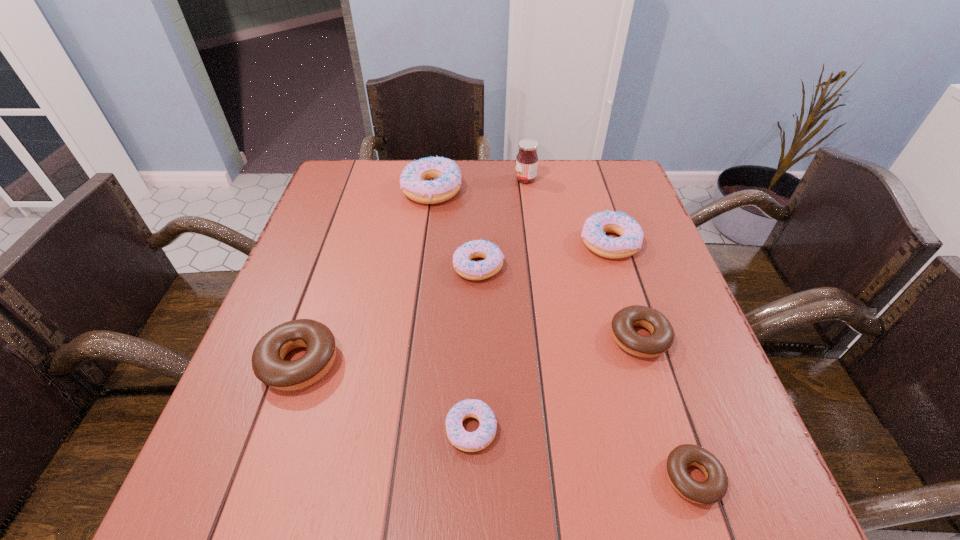
In the image, there is a desktop. Where is `free space at the far left corner`? free space at the far left corner is located at coordinates 348,184.

Identify the location of vacant region at the near left corner of the desktop. (248, 496).

Image resolution: width=960 pixels, height=540 pixels. In order to click on free spot at the far right corner of the desktop in this screenshot , I will do `click(612, 167)`.

Where is `vacant region at the near right corner of the desktop`? vacant region at the near right corner of the desktop is located at coordinates (776, 521).

You are a GUI agent. You are given a task and a screenshot of the screen. Output one action in this format:
    pyautogui.click(x=<x>, y=<y>)
    Task: Click on the unoccupied area between the nearest purple doughnut and the tallest doughnut
    
    Given the screenshot: What is the action you would take?
    pyautogui.click(x=452, y=309)

The width and height of the screenshot is (960, 540). Find the location of `vacant point located between the second biggest purple doughnut and the second biggest brown doughnut`. vacant point located between the second biggest purple doughnut and the second biggest brown doughnut is located at coordinates (624, 291).

Find the location of a particular element. The height and width of the screenshot is (540, 960). free area in between the nearest brown doughnut and the third biggest purple doughnut is located at coordinates (586, 373).

This screenshot has width=960, height=540. In order to click on free space between the nearest purple doughnut and the smallest brown doughnut in this screenshot , I will do `click(582, 454)`.

Image resolution: width=960 pixels, height=540 pixels. I want to click on empty location between the rightmost purple doughnut and the smallest brown doughnut, so click(651, 360).

Locate an element on the screen. Image resolution: width=960 pixels, height=540 pixels. vacant area that lies between the tallest object and the third biggest purple doughnut is located at coordinates (502, 223).